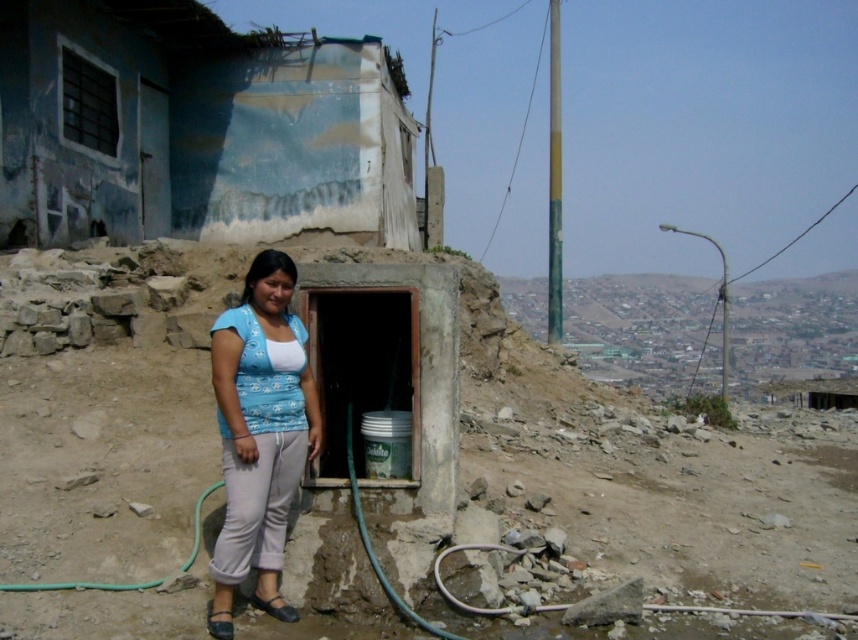
Does point (124, 100) come behind point (213, 573)?

Yes, point (124, 100) is behind point (213, 573).

Can you confirm if blue painted wall at upper left is taller than blue cotton shirt at center?

Incorrect, blue painted wall at upper left's height is not larger of blue cotton shirt at center's.

Which is behind, point (267, 58) or point (251, 280)?

Point (267, 58)

The height and width of the screenshot is (640, 858). I want to click on blue painted wall at upper left, so click(195, 128).